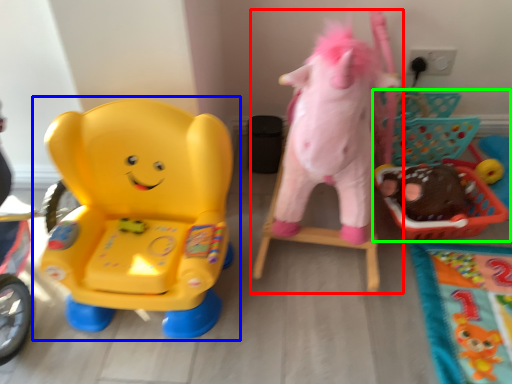
Question: Which object is positioned farthest from toy (highlighted by a red box)? Select from toy (highlighted by a blue box) and toy (highlighted by a green box).

Choices:
 (A) toy
 (B) toy

Answer: (A)